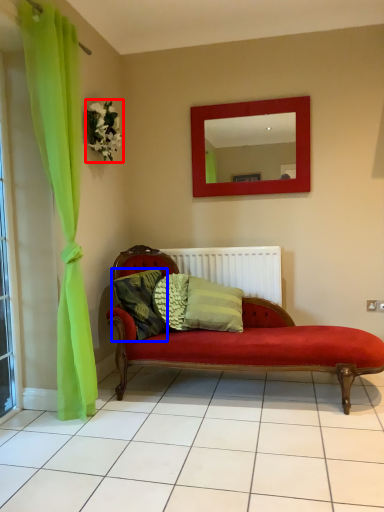
Question: Which object appears closest to the camera in this image, flower (highlighted by a red box) or pillow (highlighted by a blue box)?

Choices:
 (A) flower
 (B) pillow

Answer: (B)